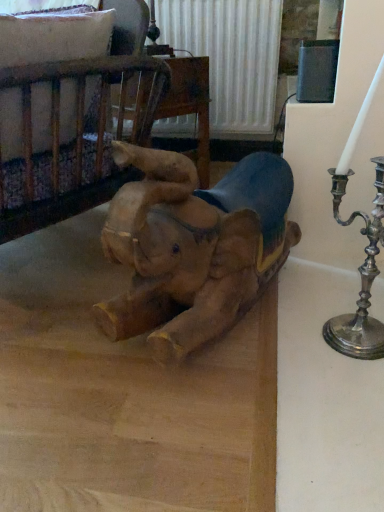
This screenshot has width=384, height=512. Identify the location of free space in front of wooden elephant at center. (213, 419).